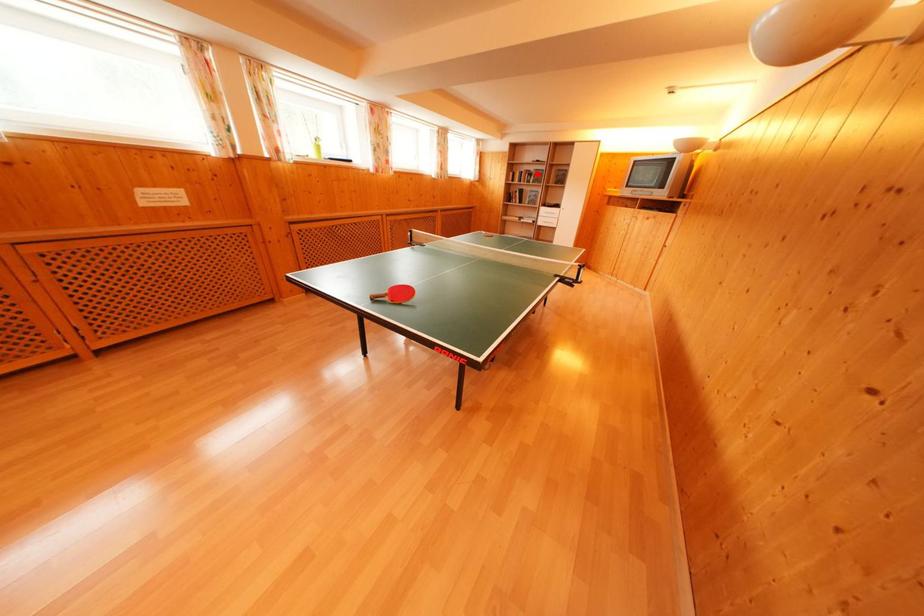
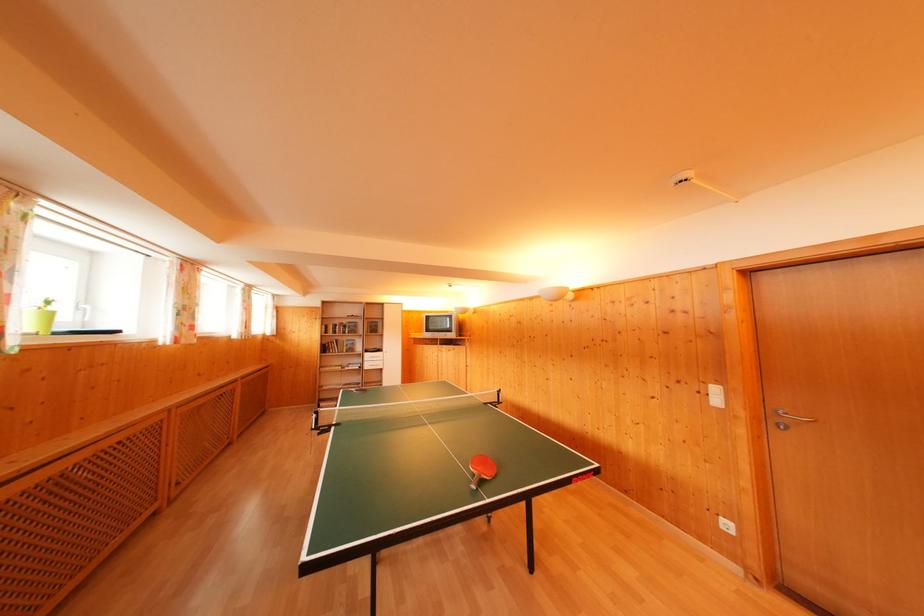
Where in the second image is the point corresponding to the highlighted location from the first image?

(349, 326)